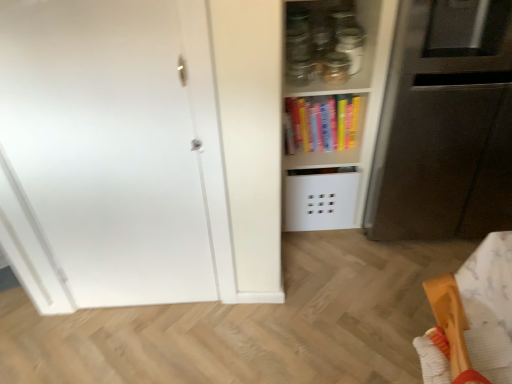
Question: From a real-world perspective, does wooden spatula at lower right sit lower than matt black microwave at right?

Choices:
 (A) yes
 (B) no

Answer: (B)

Question: Considering the relative sizes of wooden spatula at lower right and matt black microwave at right in the image provided, is wooden spatula at lower right shorter than matt black microwave at right?

Choices:
 (A) no
 (B) yes

Answer: (B)

Question: Considering the relative sizes of wooden spatula at lower right and matt black microwave at right in the image provided, is wooden spatula at lower right thinner than matt black microwave at right?

Choices:
 (A) yes
 (B) no

Answer: (A)

Question: Is wooden spatula at lower right to the left of matt black microwave at right from the viewer's perspective?

Choices:
 (A) yes
 (B) no

Answer: (A)

Question: Is wooden spatula at lower right positioned beyond the bounds of matt black microwave at right?

Choices:
 (A) yes
 (B) no

Answer: (A)

Question: In terms of width, does hardcover books at center look wider or thinner when compared to transparent glass jar at upper center?

Choices:
 (A) wide
 (B) thin

Answer: (A)

Question: Is hardcover books at center bigger or smaller than transparent glass jar at upper center?

Choices:
 (A) big
 (B) small

Answer: (A)

Question: From a real-world perspective, is hardcover books at center physically located above or below transparent glass jar at upper center?

Choices:
 (A) above
 (B) below

Answer: (B)

Question: Considering the positions of hardcover books at center and transparent glass jar at upper center in the image, is hardcover books at center taller or shorter than transparent glass jar at upper center?

Choices:
 (A) tall
 (B) short

Answer: (A)

Question: Relative to white matte door at left, is wooden spatula at lower right in front or behind?

Choices:
 (A) front
 (B) behind

Answer: (A)

Question: Is wooden spatula at lower right spatially inside white matte door at left, or outside of it?

Choices:
 (A) inside
 (B) outside

Answer: (B)

Question: From the image's perspective, is wooden spatula at lower right located above or below white matte door at left?

Choices:
 (A) below
 (B) above

Answer: (A)

Question: Considering the positions of wooden spatula at lower right and white matte door at left in the image, is wooden spatula at lower right bigger or smaller than white matte door at left?

Choices:
 (A) big
 (B) small

Answer: (B)

Question: Is transparent glass jar at upper center wider or thinner than hardcover books at center?

Choices:
 (A) thin
 (B) wide

Answer: (A)

Question: Is transparent glass jar at upper center bigger or smaller than hardcover books at center?

Choices:
 (A) small
 (B) big

Answer: (A)